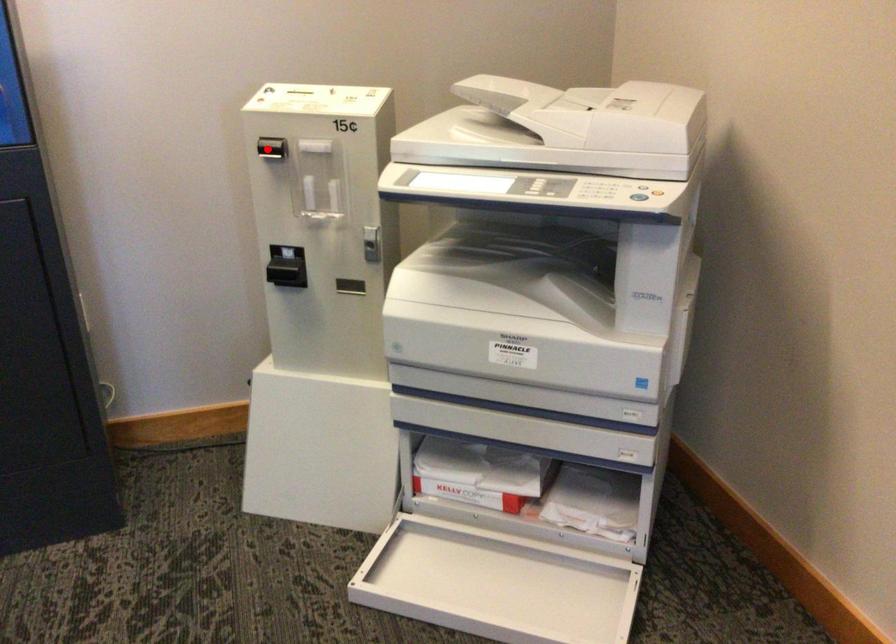
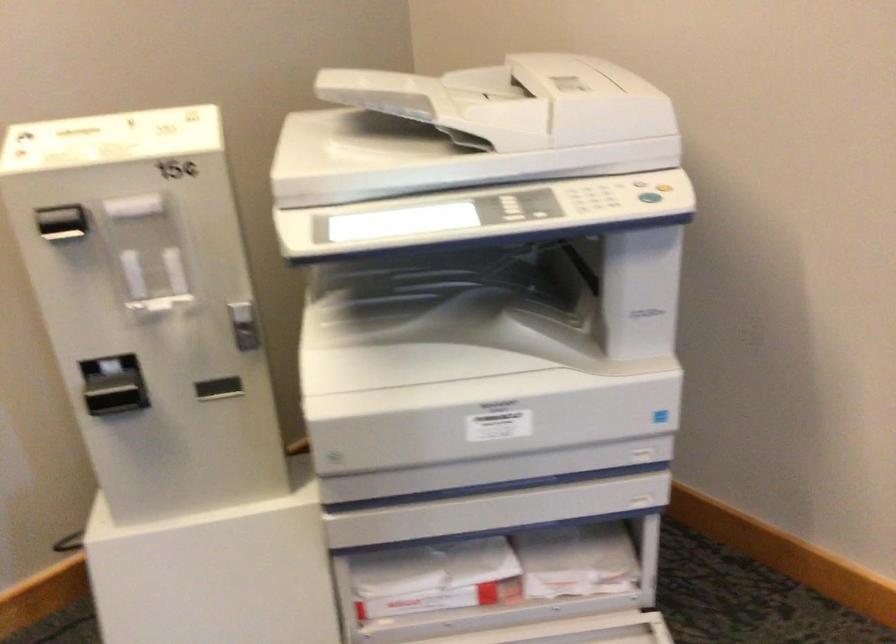
Where in the second image is the point corresponding to the highlighted location from the first image?

(62, 223)